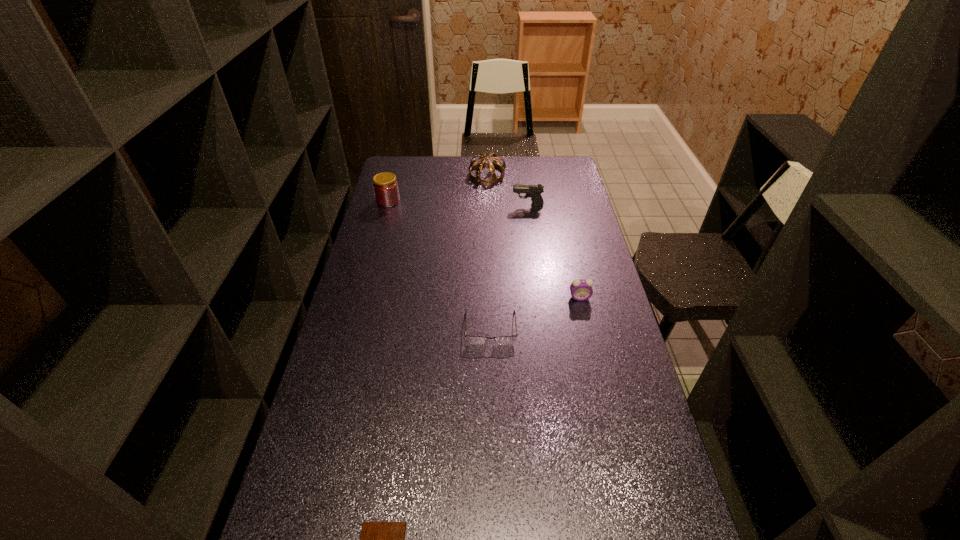
Find the location of a particular element. This screenshot has height=540, width=960. free spot at the right edge of the desktop is located at coordinates (587, 227).

Identify the location of free spot at the far right corner of the desktop. (562, 174).

This screenshot has width=960, height=540. I want to click on free space between the right alarm clock and the jam, so click(x=484, y=249).

Where is `free point between the leftmost object and the spectacles`? This screenshot has height=540, width=960. free point between the leftmost object and the spectacles is located at coordinates (440, 265).

Locate an element on the screen. vacant space that is in between the leftmost object and the second nearest object is located at coordinates (440, 265).

What are the coordinates of `free space between the jam and the pistol` in the screenshot? It's located at (458, 203).

The height and width of the screenshot is (540, 960). I want to click on vacant point located between the pistol and the right alarm clock, so click(x=554, y=252).

This screenshot has width=960, height=540. I want to click on free space between the fifth tallest object and the fourth shortest object, so click(x=509, y=267).

Locate an element on the screen. This screenshot has width=960, height=540. vacant region between the jam and the tiara is located at coordinates (438, 188).

Point out which object is positioned as the fourth nearest to the leftmost object. Please provide its 2D coordinates. Your answer should be formatted as a tuple, i.e. [(x, y)], where the tuple contains the x and y coordinates of a point satisfying the conditions above.

[(581, 289)]